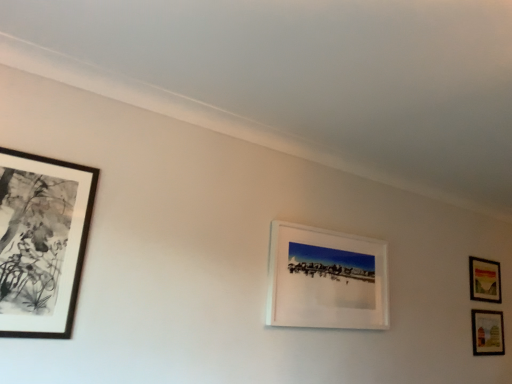
Question: From the image's perspective, relative to black matte picture frame at left, placed as the first picture frame when sorted from front to back, is matte wooden picture frame at lower right, arranged as the first picture frame when viewed from the back, above or below?

Choices:
 (A) below
 (B) above

Answer: (A)

Question: From their relative heights in the image, would you say matte wooden picture frame at lower right, arranged as the first picture frame when viewed from the back, is taller or shorter than black matte picture frame at left, the first picture frame viewed from the left?

Choices:
 (A) tall
 (B) short

Answer: (B)

Question: Which of these objects is positioned farthest from the white matte picture frame at center, which is the 2th picture frame from left to right?

Choices:
 (A) black matte picture frame at left, the first picture frame viewed from the left
 (B) matte wooden picture frame at lower right, acting as the 2th picture frame starting from the right
 (C) matte wooden picture frame at lower right, the fourth picture frame in the front-to-back sequence

Answer: (B)

Question: Estimate the real-world distances between objects in this image. Which object is farther from the matte wooden picture frame at lower right, the second picture frame in the back-to-front sequence?

Choices:
 (A) black matte picture frame at left, the first picture frame viewed from the left
 (B) white matte picture frame at center, which is counted as the second picture frame, starting from the front
 (C) matte wooden picture frame at lower right, arranged as the first picture frame when viewed from the back

Answer: (A)